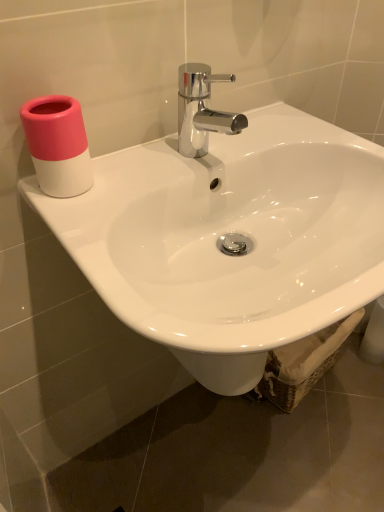
Question: Looking at their shapes, would you say white glossy sink at upper center is wider or thinner than pink matte cup at upper left?

Choices:
 (A) thin
 (B) wide

Answer: (B)

Question: Is white glossy sink at upper center situated inside pink matte cup at upper left or outside?

Choices:
 (A) inside
 (B) outside

Answer: (B)

Question: Based on their sizes in the image, would you say white glossy sink at upper center is bigger or smaller than pink matte cup at upper left?

Choices:
 (A) big
 (B) small

Answer: (A)

Question: Does point (66, 109) appear closer or farther from the camera than point (367, 275)?

Choices:
 (A) closer
 (B) farther

Answer: (B)

Question: Is pink matte cup at upper left in front of or behind white glossy sink at upper center in the image?

Choices:
 (A) front
 (B) behind

Answer: (B)

Question: From a real-world perspective, is pink matte cup at upper left above or below white glossy sink at upper center?

Choices:
 (A) above
 (B) below

Answer: (A)

Question: In terms of width, does pink matte cup at upper left look wider or thinner when compared to white glossy sink at upper center?

Choices:
 (A) thin
 (B) wide

Answer: (A)